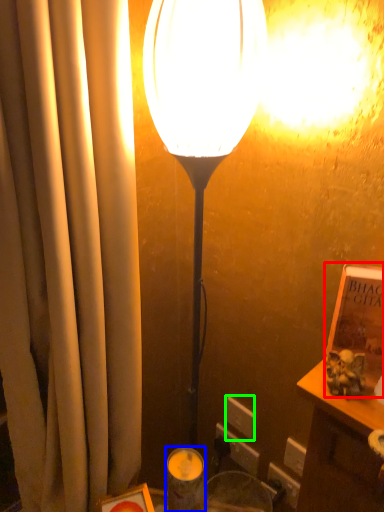
Question: Which object is the closest to the book (highlighted by a red box)? Choose among these: candle holder (highlighted by a blue box) or electric outlet (highlighted by a green box).

Choices:
 (A) candle holder
 (B) electric outlet

Answer: (A)